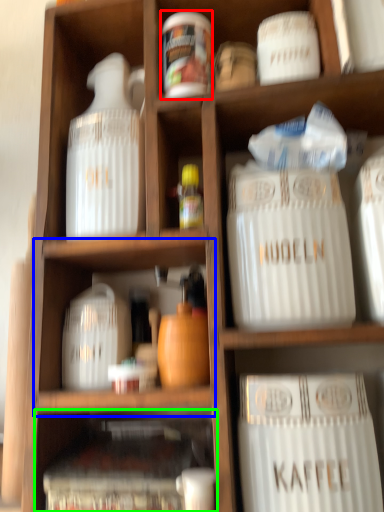
Question: Which object is the farthest from pottery (highlighted by a red box)? Choose among these: cabinet (highlighted by a blue box) or cabinet (highlighted by a green box).

Choices:
 (A) cabinet
 (B) cabinet

Answer: (B)